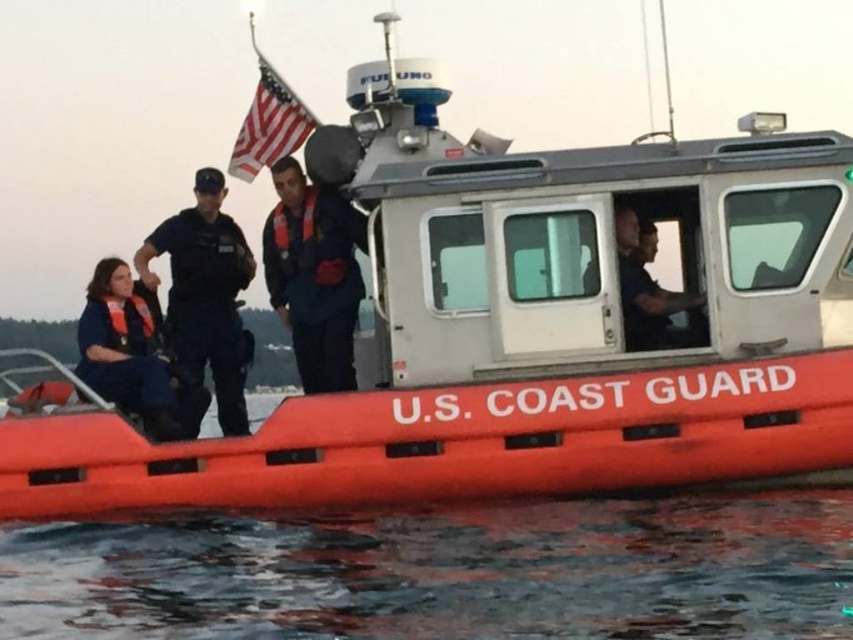
Question: Which point is farther to the camera?

Choices:
 (A) (198, 328)
 (B) (90, 608)
 (C) (86, 324)

Answer: (A)

Question: Which point appears closest to the camera in this image?

Choices:
 (A) (219, 620)
 (B) (126, 372)
 (C) (227, 268)

Answer: (A)

Question: From the image, what is the correct spatial relationship of dark blue uniform at center in relation to matte orange life vest at left?

Choices:
 (A) above
 (B) below

Answer: (A)

Question: From the image, what is the correct spatial relationship of matte black uniform at center in relation to matte orange life vest at left?

Choices:
 (A) above
 (B) below

Answer: (A)

Question: Among these objects, which one is farthest from the camera?

Choices:
 (A) matte orange life vest at left
 (B) transparent water at lower center
 (C) dark blue uniform at center

Answer: (C)

Question: Is transparent water at lower center further to the viewer compared to dark blue uniform at center?

Choices:
 (A) no
 (B) yes

Answer: (A)